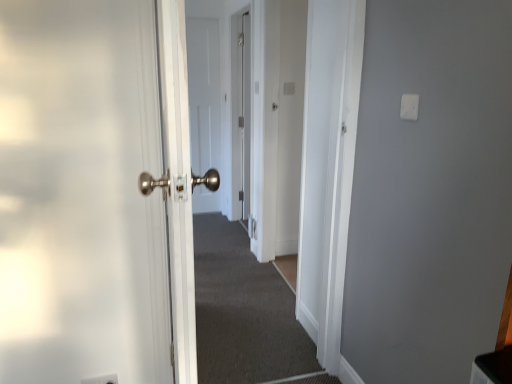
Question: Would you say carpeted corridor at center is outside white plastic light switch at upper right?

Choices:
 (A) yes
 (B) no

Answer: (A)

Question: Does carpeted corridor at center appear on the right side of white plastic light switch at upper right?

Choices:
 (A) no
 (B) yes

Answer: (A)

Question: From the image's perspective, is carpeted corridor at center located above white plastic light switch at upper right?

Choices:
 (A) no
 (B) yes

Answer: (A)

Question: Is carpeted corridor at center positioned before white plastic light switch at upper right?

Choices:
 (A) yes
 (B) no

Answer: (B)

Question: From the image's perspective, is carpeted corridor at center under white plastic light switch at upper right?

Choices:
 (A) yes
 (B) no

Answer: (A)

Question: In terms of size, does white plastic light switch at upper right appear bigger or smaller than carpeted corridor at center?

Choices:
 (A) small
 (B) big

Answer: (A)

Question: Looking at their shapes, would you say white plastic light switch at upper right is wider or thinner than carpeted corridor at center?

Choices:
 (A) thin
 (B) wide

Answer: (A)

Question: Is point (416, 97) positioned closer to the camera than point (245, 322)?

Choices:
 (A) closer
 (B) farther

Answer: (A)

Question: Is white plastic light switch at upper right in front of or behind carpeted corridor at center in the image?

Choices:
 (A) behind
 (B) front

Answer: (B)

Question: Is white matte door at center wider or thinner than white plastic light switch at upper right?

Choices:
 (A) wide
 (B) thin

Answer: (A)

Question: Is white matte door at center in front of or behind white plastic light switch at upper right in the image?

Choices:
 (A) behind
 (B) front

Answer: (A)

Question: Is white matte door at center inside the boundaries of white plastic light switch at upper right, or outside?

Choices:
 (A) inside
 (B) outside

Answer: (B)

Question: From a real-world perspective, is white matte door at center positioned above or below white plastic light switch at upper right?

Choices:
 (A) above
 (B) below

Answer: (B)

Question: From a real-world perspective, relative to white plastic light switch at upper right, is carpeted corridor at center vertically above or below?

Choices:
 (A) above
 (B) below

Answer: (B)

Question: In terms of width, does carpeted corridor at center look wider or thinner when compared to white plastic light switch at upper right?

Choices:
 (A) wide
 (B) thin

Answer: (A)